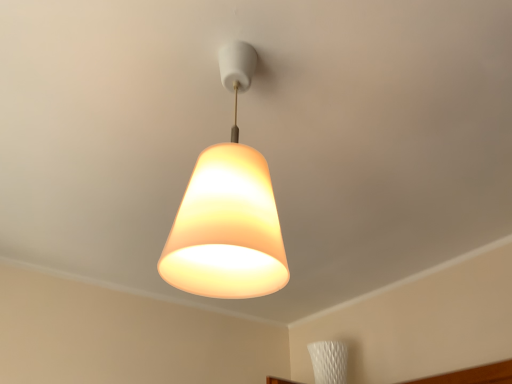
Locate an element on the screen. matte orange lampshade at center is located at coordinates (228, 212).

The image size is (512, 384). What do you see at coordinates (228, 212) in the screenshot?
I see `matte orange lampshade at center` at bounding box center [228, 212].

Locate an element on the screen. matte orange lampshade at center is located at coordinates (228, 212).